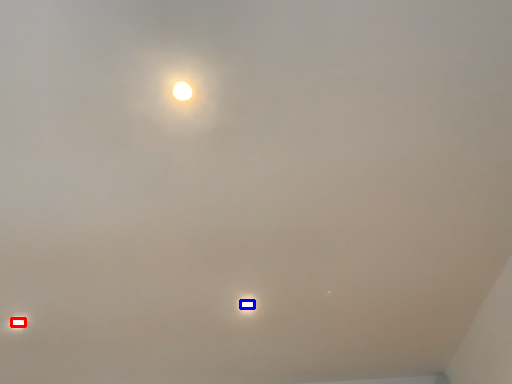
Question: Among these objects, which one is farthest to the camera, lamp (highlighted by a red box) or lamp (highlighted by a blue box)?

Choices:
 (A) lamp
 (B) lamp

Answer: (A)